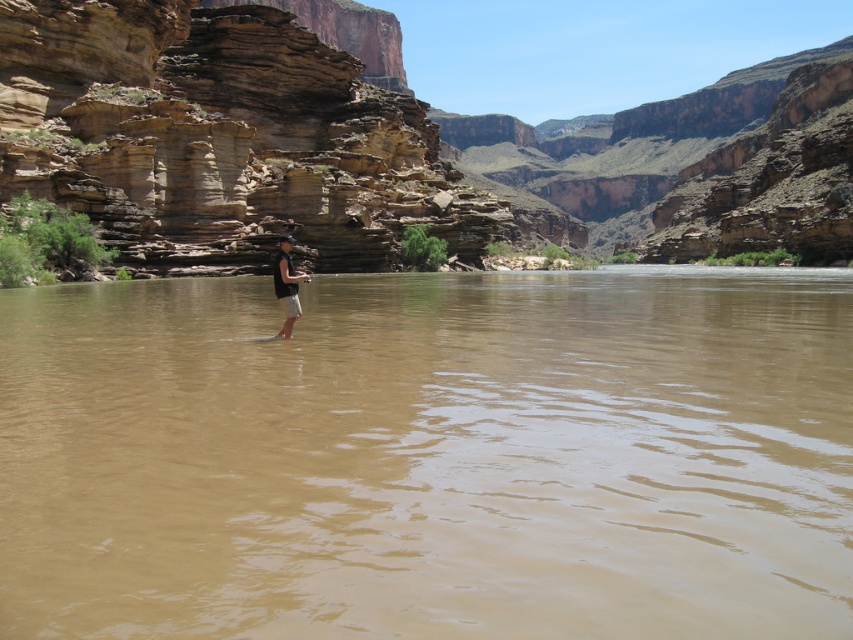
Question: Does brown rock canyon at center appear on the right side of dark gray fabric shirt at center?

Choices:
 (A) yes
 (B) no

Answer: (A)

Question: Which object is closer to the camera taking this photo?

Choices:
 (A) dark gray fabric shirt at center
 (B) brown muddy water at center
 (C) brown rock canyon at center

Answer: (B)

Question: Is brown rock canyon at center smaller than dark gray fabric shirt at center?

Choices:
 (A) no
 (B) yes

Answer: (A)

Question: Is brown rock canyon at center closer to the viewer compared to dark gray fabric shirt at center?

Choices:
 (A) no
 (B) yes

Answer: (A)

Question: Which object is farther from the camera taking this photo?

Choices:
 (A) brown muddy water at center
 (B) brown rock canyon at center

Answer: (B)

Question: Which point appears closest to the camera in this image?

Choices:
 (A) (108, 58)
 (B) (296, 276)

Answer: (B)